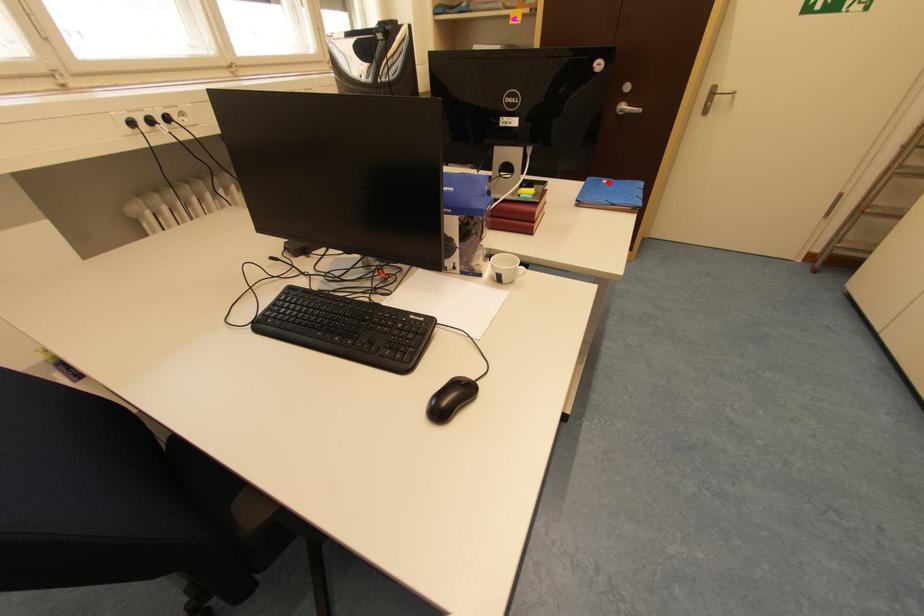
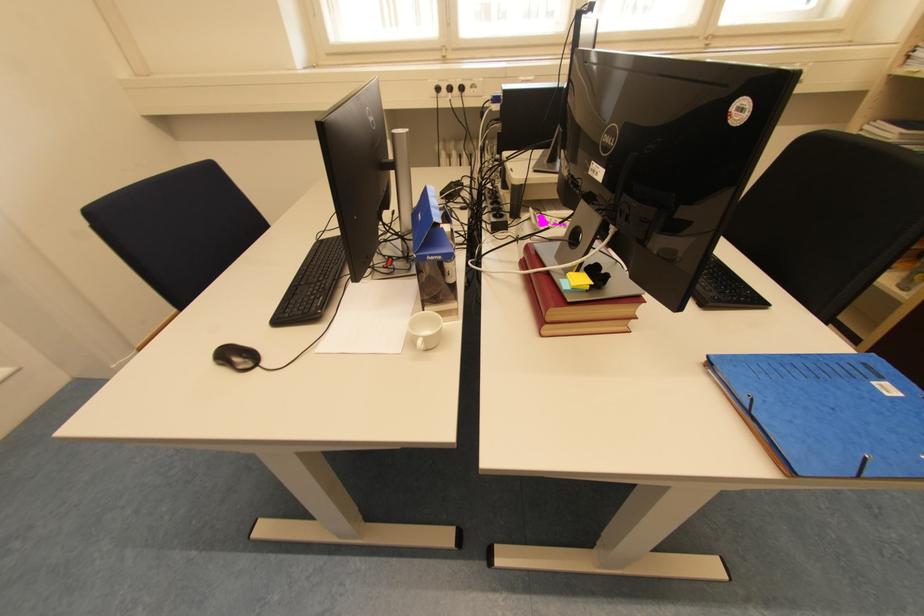
The point at the highlighted location is marked in the first image. Where is the corresponding point in the second image?

(888, 379)